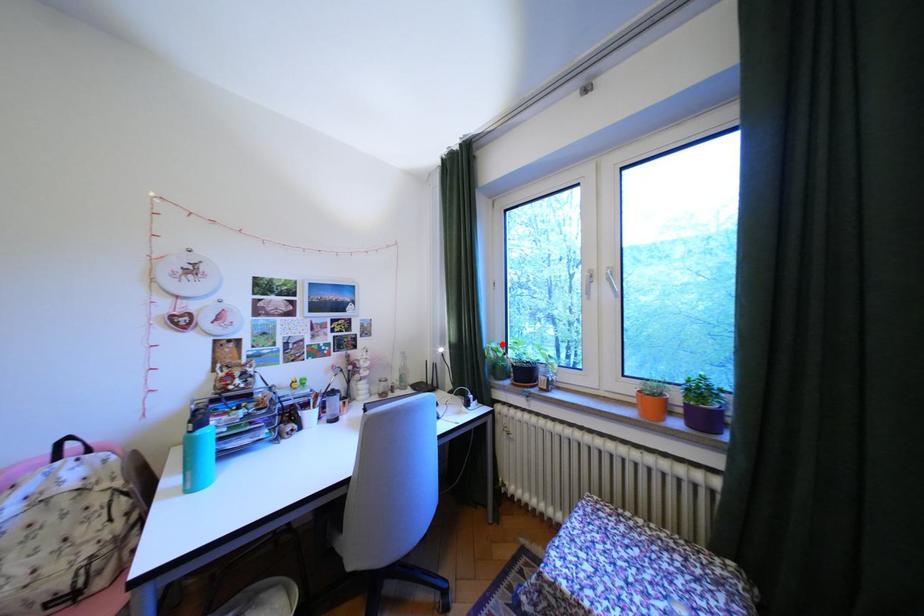
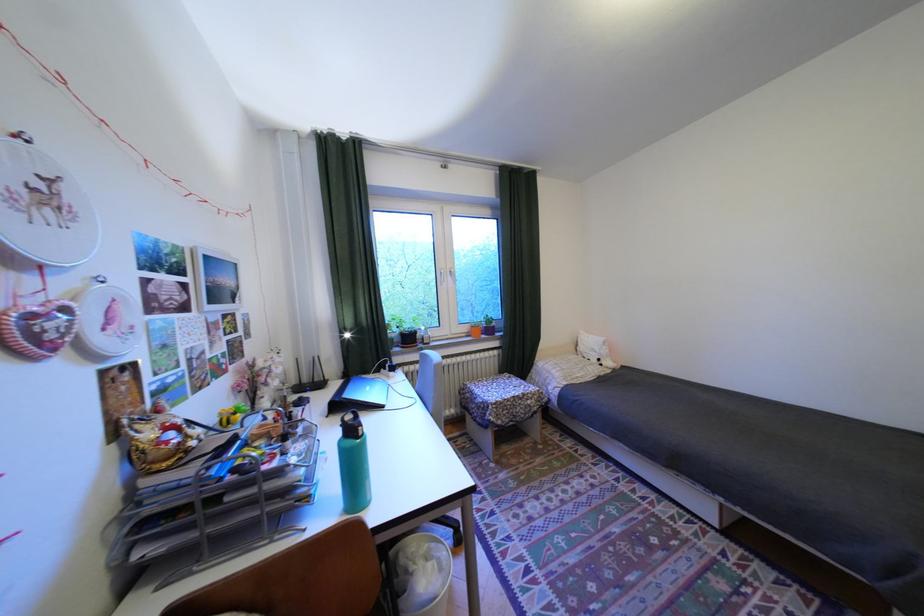
The point at the highlighted location is marked in the first image. Where is the corresponding point in the second image?

(397, 322)